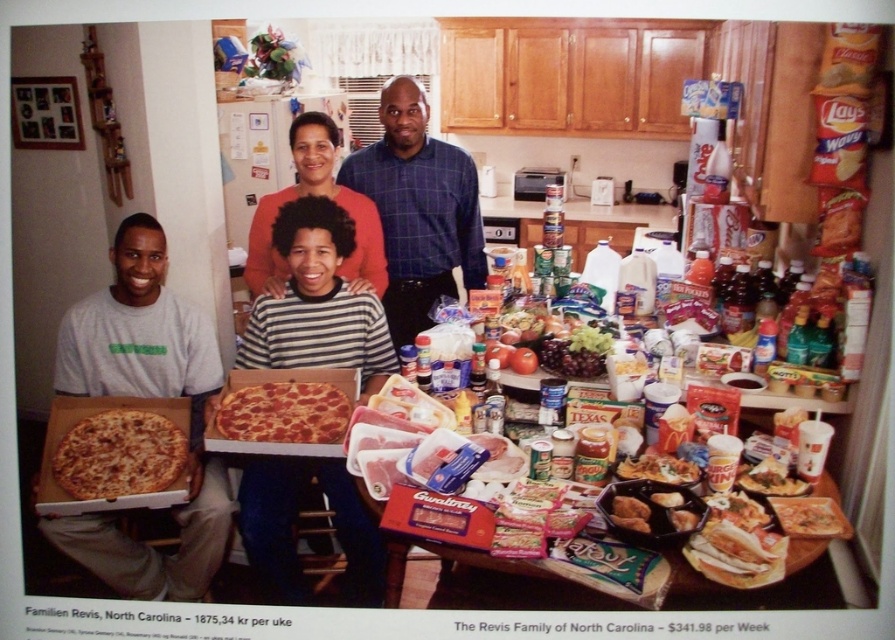
You are a guest at this family gathering and want to grab the pepperoni pizza at center to serve yourself. However, there is a white matte shirt at lower left blocking your path. Can you reach the pizza without moving the shirt?

The white matte shirt at lower left is positioned on the left side of pepperoni pizza at center, so you can reach the pizza by moving around the right side of the shirt.